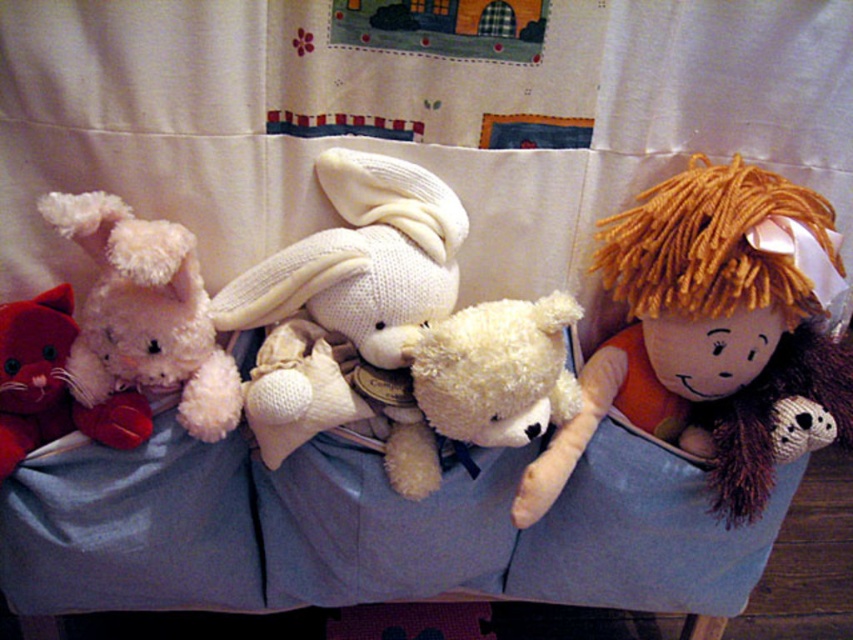
Does yarn doll at right lie behind fluffy white teddy bear at center?

No.

Which is more to the left, yarn doll at right or fluffy white teddy bear at center?

fluffy white teddy bear at center

Where is `yarn doll at right`? This screenshot has height=640, width=853. yarn doll at right is located at coordinates (714, 333).

Does fluffy white teddy bear at center appear on the left side of velvet red cat at left?

Incorrect, fluffy white teddy bear at center is not on the left side of velvet red cat at left.

Who is more forward, (520, 323) or (1, 448)?

Positioned in front is point (1, 448).

Which is in front, point (460, 424) or point (24, 369)?

Point (24, 369) is more forward.

The height and width of the screenshot is (640, 853). In order to click on fluffy white teddy bear at center in this screenshot , I will do `click(483, 384)`.

Is yarn doll at right below fluffy white teddy bear at left?

Yes.

Locate an element on the screen. The height and width of the screenshot is (640, 853). yarn doll at right is located at coordinates (714, 333).